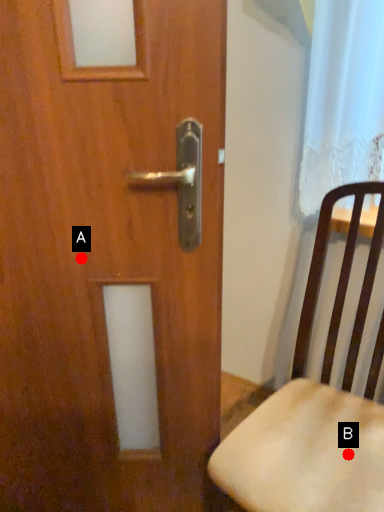
Question: Two points are circled on the image, labeled by A and B beside each circle. Which point is further to the camera?

Choices:
 (A) A is further
 (B) B is further

Answer: (B)